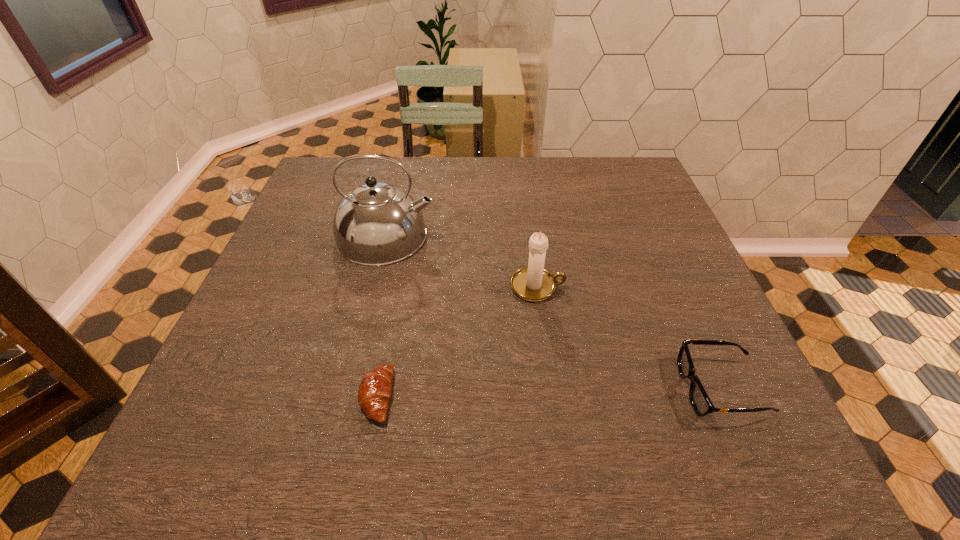
Identify the location of blank area located on the front-facing side of the rightmost object. The height and width of the screenshot is (540, 960). (541, 388).

I want to click on free region located on the front-facing side of the rightmost object, so click(x=585, y=388).

Locate an element on the screen. The width and height of the screenshot is (960, 540). vacant space located on the back of the shortest object is located at coordinates (399, 275).

Locate an element on the screen. Image resolution: width=960 pixels, height=540 pixels. object that is positioned at the near edge is located at coordinates (375, 389).

Find the location of a particular element. object present at the left edge is located at coordinates pyautogui.click(x=377, y=223).

What are the coordinates of `object that is positioned at the right edge` in the screenshot? It's located at (700, 401).

Where is `free space at the far edge of the desktop`? This screenshot has width=960, height=540. free space at the far edge of the desktop is located at coordinates (459, 186).

In the image, there is a desktop. Where is `vacant space at the left edge`? Image resolution: width=960 pixels, height=540 pixels. vacant space at the left edge is located at coordinates (268, 404).

Where is `vacant space at the right edge of the desktop`? The width and height of the screenshot is (960, 540). vacant space at the right edge of the desktop is located at coordinates (689, 303).

Locate an element on the screen. The height and width of the screenshot is (540, 960). vacant area at the far right corner of the desktop is located at coordinates (613, 161).